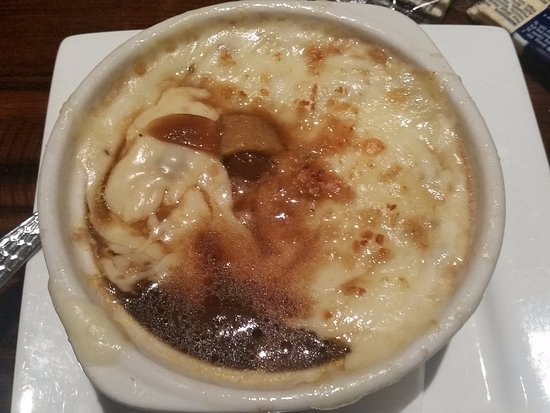
This screenshot has width=550, height=413. In order to click on package on table in this screenshot , I will do `click(517, 7)`, `click(434, 11)`.